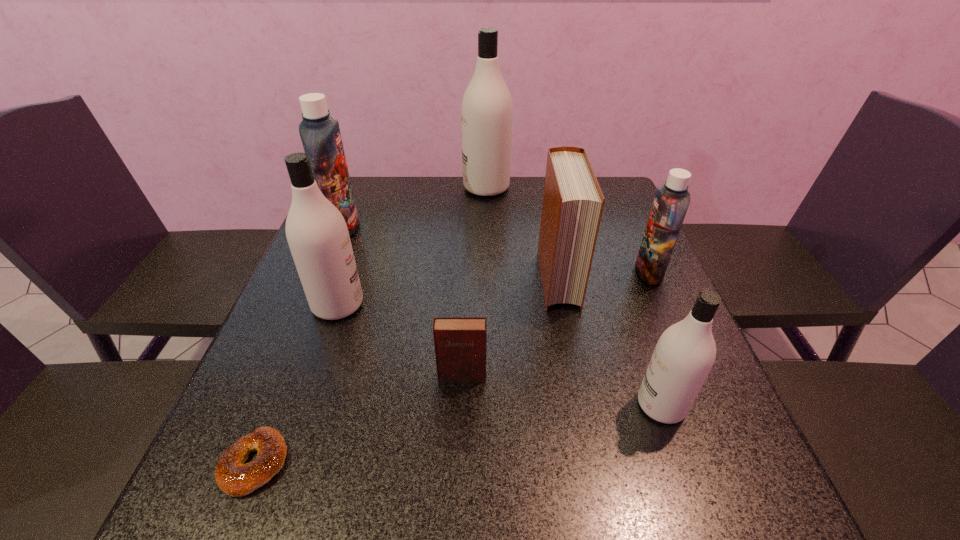
Identify which shampoo is located as the nearest to the bigger blue shampoo. Please provide its 2D coordinates. Your answer should be formatted as a tuple, i.e. [(x, y)], where the tuple contains the x and y coordinates of a point satisfying the conditions above.

[(317, 234)]

The width and height of the screenshot is (960, 540). What are the coordinates of `white shampoo that is the third closest to the sixth object from left to right` in the screenshot? It's located at (317, 234).

Identify which white shampoo is the nearest to the second biggest white shampoo. Please provide its 2D coordinates. Your answer should be formatted as a tuple, i.e. [(x, y)], where the tuple contains the x and y coordinates of a point satisfying the conditions above.

[(487, 109)]

This screenshot has width=960, height=540. Find the location of `blank space that satisfies the following two spatial constraints: 1. on the back side of the brown bagel; 2. on the front label of the farther blue shampoo`. blank space that satisfies the following two spatial constraints: 1. on the back side of the brown bagel; 2. on the front label of the farther blue shampoo is located at coordinates (348, 228).

You are a GUI agent. You are given a task and a screenshot of the screen. Output one action in this format:
    pyautogui.click(x=<x>, y=<y>)
    Task: Click on the vacant space that satisfies the following two spatial constraints: 1. on the front label of the left blue shampoo; 2. on the left side of the bagel
    
    Given the screenshot: What is the action you would take?
    pyautogui.click(x=247, y=463)